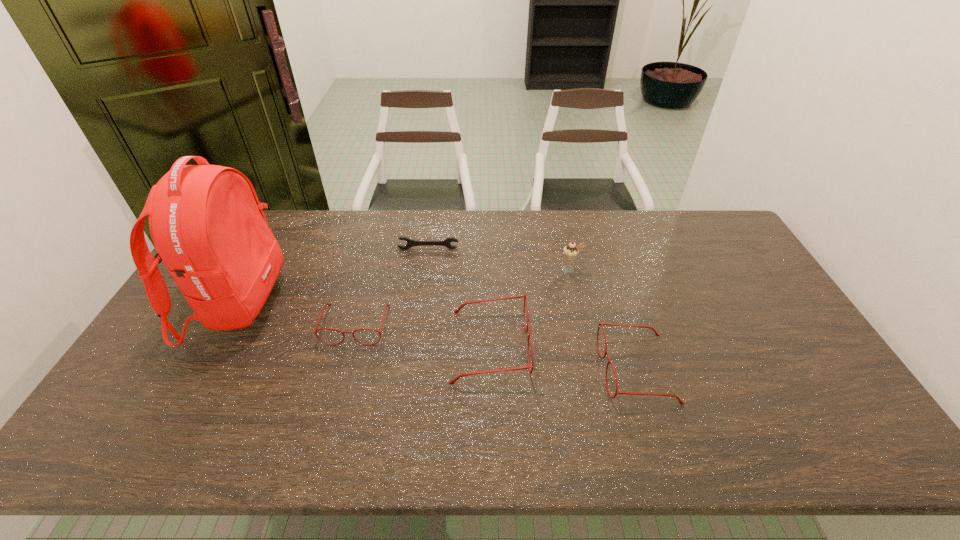
You are a GUI agent. You are given a task and a screenshot of the screen. Output one action in this format:
    pyautogui.click(x=<x>, y=<y>)
    Task: Click on the free space located 0.200m on the face of the shortest spectacles
    
    Given the screenshot: What is the action you would take?
    pos(333,410)

Find the location of a particular element. The height and width of the screenshot is (540, 960). vacant space located 0.350m on the face of the second spectacles from left to right is located at coordinates (654, 346).

Identify the location of free space located 0.140m on the face of the second shortest spectacles. (549, 369).

Find the location of a particular element. This screenshot has width=960, height=540. blank area located on the face of the second shortest spectacles is located at coordinates (489, 369).

At what (x,y) coordinates should I click in order to perform the action: click on free space located on the face of the second shortest spectacles. Please return your answer as a coordinate pair (x, y). Looking at the image, I should click on (519, 369).

The height and width of the screenshot is (540, 960). Identify the location of vacant space located 0.050m on the right of the fifth shortest object. (596, 270).

Locate an element on the screen. vacant point located on the open ends of the farthest object is located at coordinates (417, 332).

The width and height of the screenshot is (960, 540). In order to click on free spot located 0.330m on the main compartment of the backpack in this screenshot , I will do `click(389, 304)`.

At what (x,y) coordinates should I click in order to perform the action: click on object that is at the far edge. Please return your answer as a coordinate pair (x, y). Looking at the image, I should click on (410, 243).

The image size is (960, 540). What are the coordinates of `object that is at the left edge` in the screenshot? It's located at (206, 222).